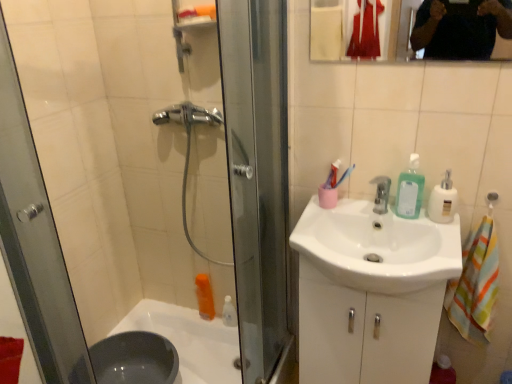
Question: Does white plastic soap dispenser at right appear on the left side of green translucent liquid soap at upper right?

Choices:
 (A) no
 (B) yes

Answer: (A)

Question: From the image's perspective, does white plastic soap dispenser at right appear higher than green translucent liquid soap at upper right?

Choices:
 (A) no
 (B) yes

Answer: (A)

Question: Considering the relative sizes of white plastic soap dispenser at right and green translucent liquid soap at upper right in the image provided, is white plastic soap dispenser at right shorter than green translucent liquid soap at upper right?

Choices:
 (A) no
 (B) yes

Answer: (B)

Question: Is green translucent liquid soap at upper right surrounded by white plastic soap dispenser at right?

Choices:
 (A) yes
 (B) no

Answer: (B)

Question: Can we say white plastic soap dispenser at right lies outside green translucent liquid soap at upper right?

Choices:
 (A) yes
 (B) no

Answer: (A)

Question: Is the position of white plastic soap dispenser at right less distant than that of green translucent liquid soap at upper right?

Choices:
 (A) yes
 (B) no

Answer: (A)

Question: Is white plastic soap dispenser at right placed right next to white glossy sink at center?

Choices:
 (A) no
 (B) yes

Answer: (A)

Question: Does white plastic soap dispenser at right have a lesser height compared to white glossy sink at center?

Choices:
 (A) no
 (B) yes

Answer: (B)

Question: Can you confirm if white plastic soap dispenser at right is bigger than white glossy sink at center?

Choices:
 (A) yes
 (B) no

Answer: (B)

Question: Could you tell me if white plastic soap dispenser at right is turned towards white glossy sink at center?

Choices:
 (A) no
 (B) yes

Answer: (A)

Question: Is white glossy sink at center surrounded by white plastic soap dispenser at right?

Choices:
 (A) no
 (B) yes

Answer: (A)

Question: From the image's perspective, does white plastic soap dispenser at right appear lower than white glossy sink at center?

Choices:
 (A) no
 (B) yes

Answer: (A)

Question: Is white plastic soap dispenser at right aimed at silver metallic faucet at center?

Choices:
 (A) yes
 (B) no

Answer: (B)